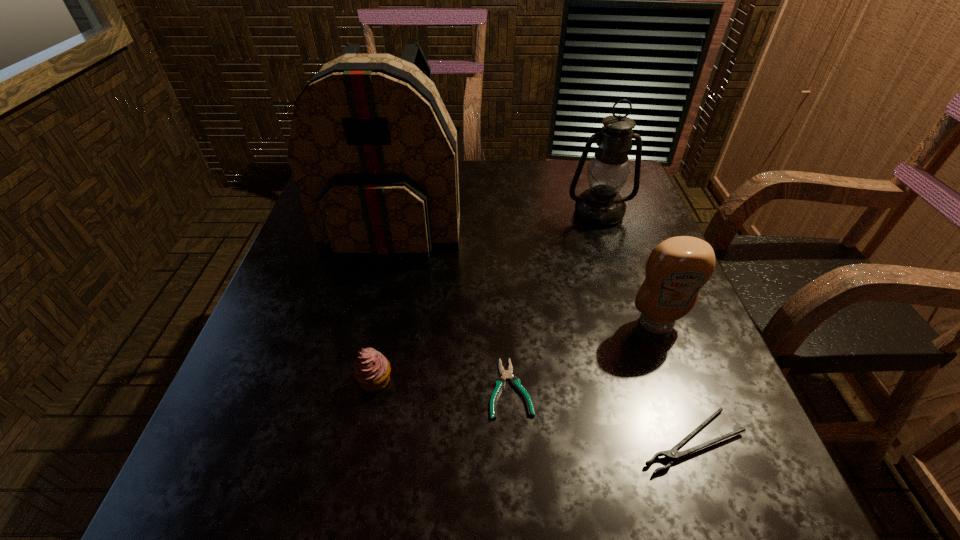
What are the coordinates of `tongs that is at the right edge` in the screenshot? It's located at (x=672, y=454).

The width and height of the screenshot is (960, 540). I want to click on object present at the far left corner, so click(373, 151).

Where is `object that is at the far right corner`? Image resolution: width=960 pixels, height=540 pixels. object that is at the far right corner is located at coordinates pos(602,205).

Where is `object located in the near right corner section of the desktop`? object located in the near right corner section of the desktop is located at coordinates (x=672, y=454).

Identify the location of vacant region at the far edge of the desktop. (x=468, y=197).

Locate an element on the screen. This screenshot has height=540, width=960. vacant space at the near edge of the desktop is located at coordinates (627, 490).

In the image, there is a desktop. Where is `free space at the left edge`? The height and width of the screenshot is (540, 960). free space at the left edge is located at coordinates (265, 371).

Where is `free spot at the right edge of the desktop`? Image resolution: width=960 pixels, height=540 pixels. free spot at the right edge of the desktop is located at coordinates (655, 359).

Where is `free space that is in between the tallest object and the shortest object`? free space that is in between the tallest object and the shortest object is located at coordinates (452, 305).

The image size is (960, 540). Identify the location of empty location between the tallest object and the third shortest object. (385, 301).